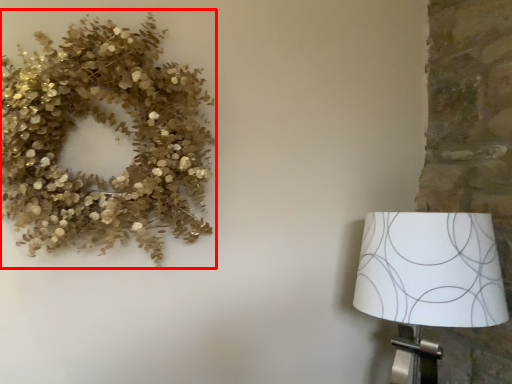
Question: From the image's perspective, where is floral arrangement (annotated by the red box) located in relation to lamp in the image?

Choices:
 (A) above
 (B) below

Answer: (A)